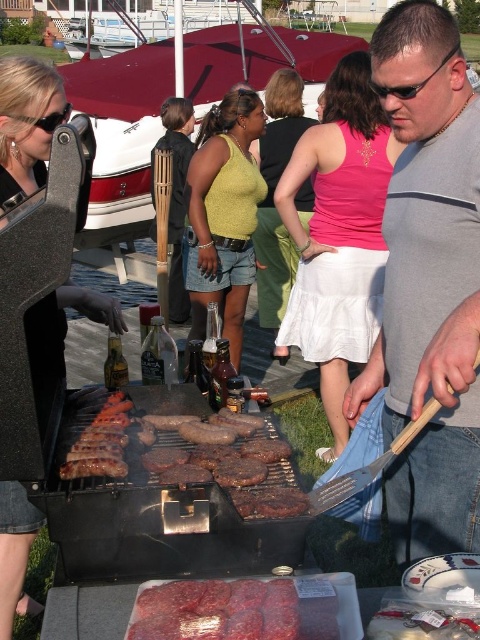
You are at a barbecue and want to grab a drink from the cooler located at the green knit sweater at center. To reach it, you need to walk around the matte black grill at left. Since the grill is in your way, which side of the grill should you go around to get to the sweater?

The matte black grill at left is positioned on the right side of green knit sweater at center, so to reach the sweater, you should go around the left side of the grill.

You are a photographer holding a camera. You want to take a photo of the pink fabric skirt at center from a distance that allows you to capture the entire skirt without zooming. The camera has a maximum focal length of 50mm. Given that the skirt requires a minimum distance of 10 feet to be fully in frame, can you take the photo from your current position?

The pink fabric skirt at center and camera are 13.55 feet apart. Since the minimum required distance is 10 feet, the photographer can take the photo from the current position as 13.55 feet is greater than 10 feet.